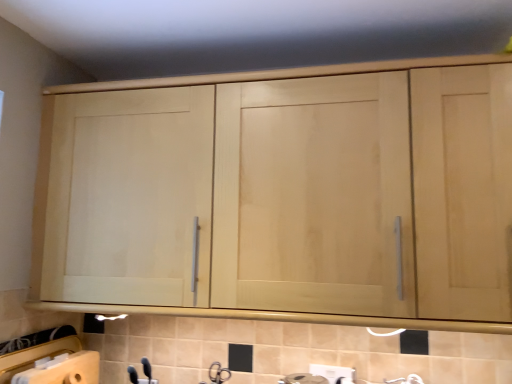
Question: From the image's perspective, is matte silver faucet at lower center under light wood cabinet at upper center?

Choices:
 (A) yes
 (B) no

Answer: (A)

Question: Is matte silver faucet at lower center thinner than light wood cabinet at upper center?

Choices:
 (A) yes
 (B) no

Answer: (A)

Question: Is matte silver faucet at lower center outside light wood cabinet at upper center?

Choices:
 (A) no
 (B) yes

Answer: (B)

Question: Is matte silver faucet at lower center far away from light wood cabinet at upper center?

Choices:
 (A) yes
 (B) no

Answer: (B)

Question: Is matte silver faucet at lower center further to camera compared to light wood cabinet at upper center?

Choices:
 (A) no
 (B) yes

Answer: (B)

Question: Can you confirm if matte silver faucet at lower center is smaller than light wood cabinet at upper center?

Choices:
 (A) no
 (B) yes

Answer: (B)

Question: Is the depth of light wood cabinet at upper center less than that of matte silver faucet at lower center?

Choices:
 (A) yes
 (B) no

Answer: (A)

Question: Is light wood cabinet at upper center facing away from matte silver faucet at lower center?

Choices:
 (A) no
 (B) yes

Answer: (A)

Question: Does light wood cabinet at upper center have a lesser width compared to matte silver faucet at lower center?

Choices:
 (A) no
 (B) yes

Answer: (A)

Question: From a real-world perspective, is light wood cabinet at upper center over matte silver faucet at lower center?

Choices:
 (A) yes
 (B) no

Answer: (A)

Question: Is light wood cabinet at upper center outside matte silver faucet at lower center?

Choices:
 (A) no
 (B) yes

Answer: (B)

Question: Does light wood cabinet at upper center turn towards matte silver faucet at lower center?

Choices:
 (A) yes
 (B) no

Answer: (B)

Question: Does point (76, 114) appear closer or farther from the camera than point (212, 362)?

Choices:
 (A) farther
 (B) closer

Answer: (B)